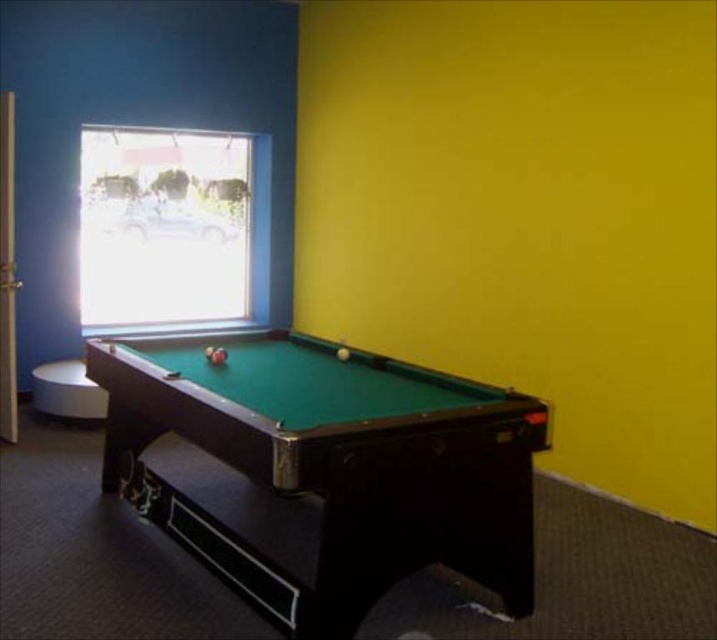
This screenshot has height=640, width=717. I want to click on green felt pool table at center, so tap(333, 465).

Which of these two, green felt pool table at center or transparent glass window at upper left, stands taller?

With more height is transparent glass window at upper left.

At what (x,y) coordinates should I click in order to perform the action: click on green felt pool table at center. Please return your answer as a coordinate pair (x, y). The height and width of the screenshot is (640, 717). Looking at the image, I should click on (333, 465).

Is transparent glass window at upper left wider than white matte stool at lower left?

Yes.

Which is in front, point (176, 172) or point (60, 390)?

Point (60, 390) is in front.

Identify the location of transparent glass window at upper left. The width and height of the screenshot is (717, 640). (171, 228).

Is green felt pool table at center bigger than white matte stool at lower left?

Yes.

Is green felt pool table at center shorter than white matte stool at lower left?

No, green felt pool table at center is not shorter than white matte stool at lower left.

This screenshot has height=640, width=717. Describe the element at coordinates (333, 465) in the screenshot. I see `green felt pool table at center` at that location.

At what (x,y) coordinates should I click in order to perform the action: click on green felt pool table at center. Please return your answer as a coordinate pair (x, y). Looking at the image, I should click on (333, 465).